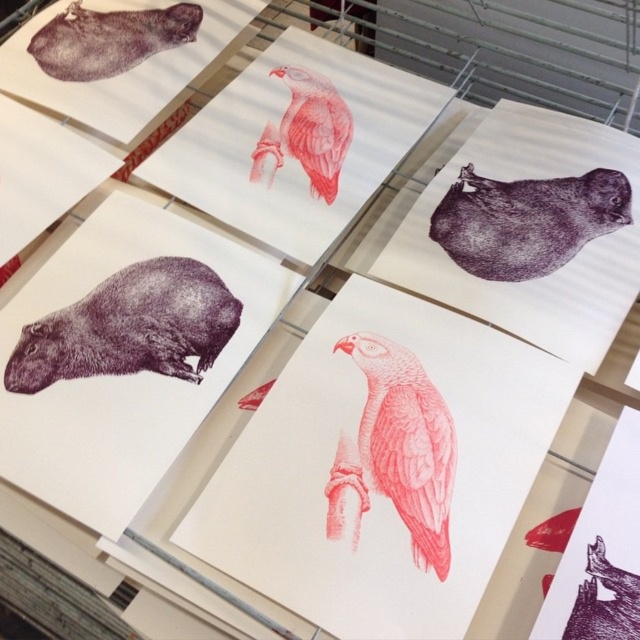
Which is below, purple ink capybara at upper right or purple matte capybara at upper left?

purple ink capybara at upper right is lower down.

Is purple ink capybara at upper right below purple matte capybara at upper left?

Correct, purple ink capybara at upper right is located below purple matte capybara at upper left.

Between point (627, 220) and point (145, 54), which one is positioned behind?

Point (145, 54)

I want to click on purple ink capybara at upper right, so click(525, 220).

Can you confirm if purple matte capybara at upper left is thinner than red textured bird at center?

No, purple matte capybara at upper left is not thinner than red textured bird at center.

Locate an element on the screen. This screenshot has height=640, width=640. purple matte capybara at upper left is located at coordinates (109, 38).

Identify the location of purple matte capybara at upper left. The image size is (640, 640). (109, 38).

In order to click on purple matte capybara at upper left in this screenshot , I will do `click(109, 38)`.

Can you confirm if pink paper parrot at center is positioned to the left of purple matte capybara at upper left?

No, pink paper parrot at center is not to the left of purple matte capybara at upper left.

Who is more forward, [404,486] or [160,44]?

Point [404,486] is in front.

Where is `pink paper parrot at center`? The height and width of the screenshot is (640, 640). pink paper parrot at center is located at coordinates (406, 444).